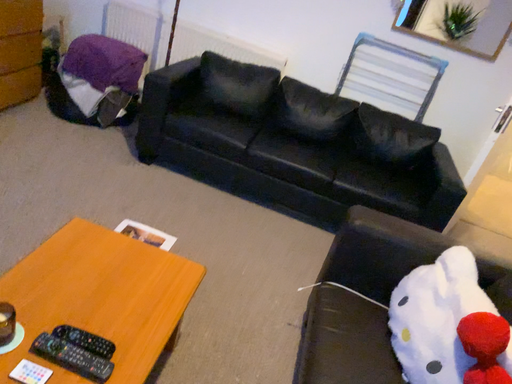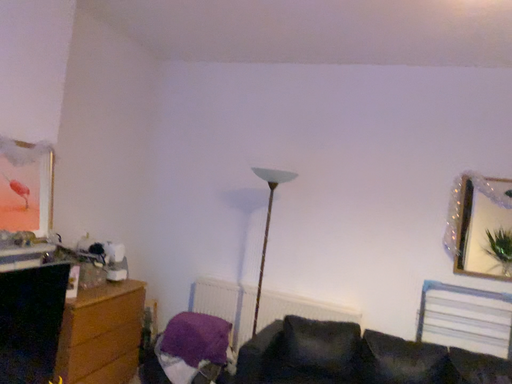
Question: Which way did the camera rotate in the video?

Choices:
 (A) rotated upward
 (B) rotated downward

Answer: (A)